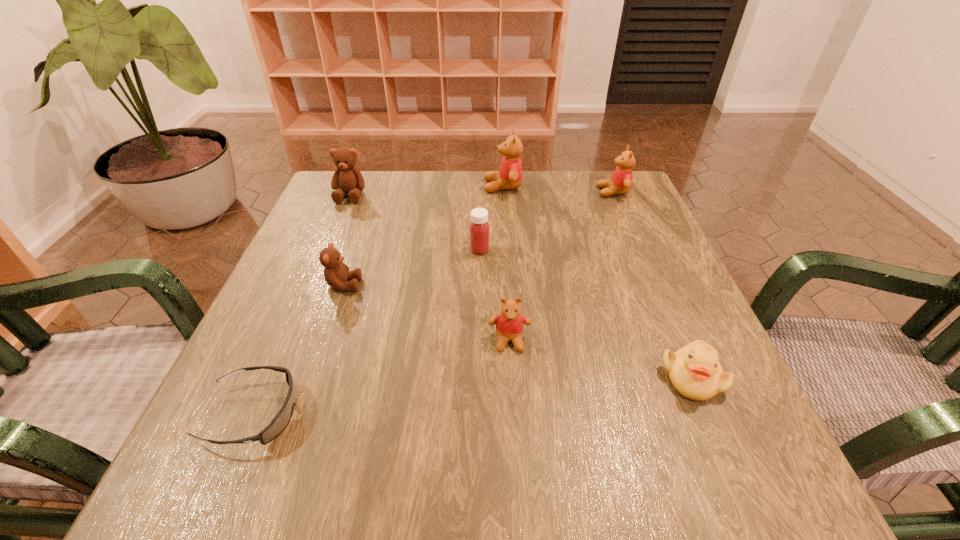
At what (x,y) coordinates should I click in order to perform the action: click on the nearest red teddy bear. Please return your answer as a coordinate pair (x, y). Looking at the image, I should click on (509, 324).

Locate an element on the screen. This screenshot has width=960, height=540. duckling is located at coordinates (694, 370).

Image resolution: width=960 pixels, height=540 pixels. What are the coordinates of `goggles` in the screenshot? It's located at (281, 420).

Locate an element on the screen. This screenshot has height=540, width=960. black goggles is located at coordinates (281, 420).

Identify the location of vacant space located 0.300m on the front-facing side of the tallest object. (369, 186).

Where is `vacant space located on the front-facing side of the tallest object`? Image resolution: width=960 pixels, height=540 pixels. vacant space located on the front-facing side of the tallest object is located at coordinates (403, 186).

Identify the location of free space located 0.130m on the front-facing side of the tallest object. The height and width of the screenshot is (540, 960). (434, 186).

You are a GUI agent. You are given a task and a screenshot of the screen. Output one action in this format:
    pyautogui.click(x=<x>, y=<y>)
    Task: Click on the vacant space located 0.070m on the front-facing side of the rightmost red teddy bear
    The width and height of the screenshot is (960, 540).
    Given the screenshot: What is the action you would take?
    pyautogui.click(x=570, y=192)

Where is `vacant area situated 0.240m on the front-facing side of the rightmost red teddy bear`? vacant area situated 0.240m on the front-facing side of the rightmost red teddy bear is located at coordinates (504, 192).

Locate an element on the screen. This screenshot has width=960, height=540. vacant space located on the front-facing side of the rightmost red teddy bear is located at coordinates (457, 192).